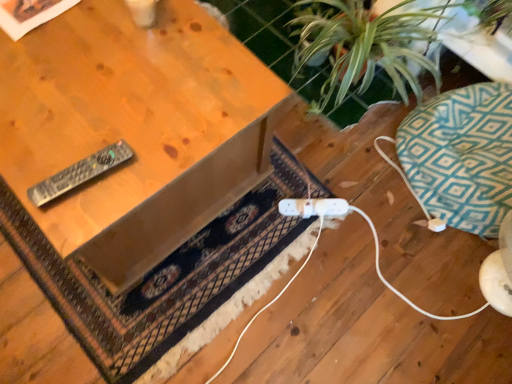
You are a GUI agent. You are given a task and a screenshot of the screen. Output one action in this format:
    pyautogui.click(x=<x>, y=<y>)
    Task: Click on the vacant area on the back side of white plastic plug at lower center
    
    Given the screenshot: What is the action you would take?
    pyautogui.click(x=304, y=176)